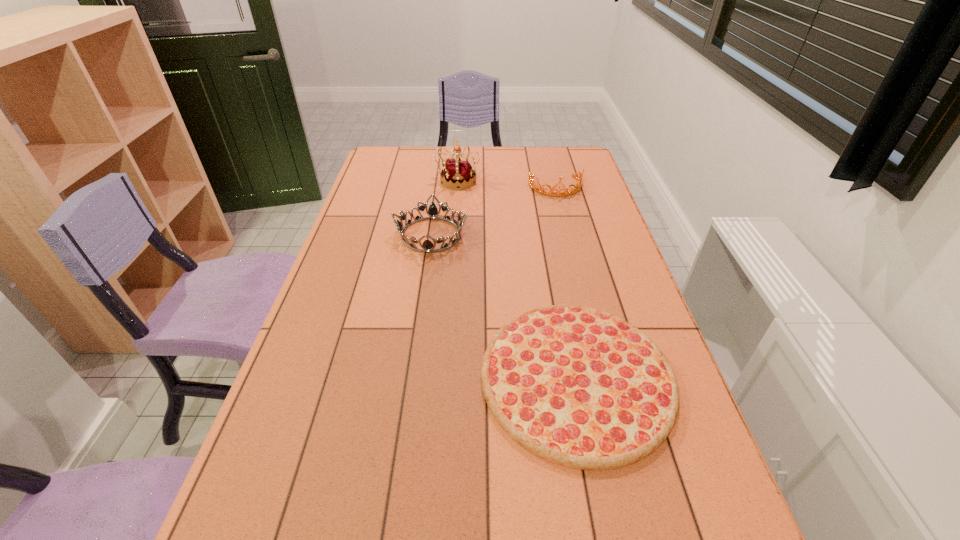
You are a GUI agent. You are given a task and a screenshot of the screen. Output one action in this format:
    pyautogui.click(x=<x>, y=<y>)
    Task: Click on the vacant space that satisfies the following two spatial constraints: 1. on the front-facing side of the nearest tiara; 2. on the left side of the pizza
    The width and height of the screenshot is (960, 540).
    Given the screenshot: What is the action you would take?
    pyautogui.click(x=411, y=377)

Where is `free location that satisfies the following two spatial constraints: 1. on the front-facing side of the pizza; 2. on the left side of the tallest object`? Image resolution: width=960 pixels, height=540 pixels. free location that satisfies the following two spatial constraints: 1. on the front-facing side of the pizza; 2. on the left side of the tallest object is located at coordinates (444, 377).

Identify the location of vacant area that satisfies the following two spatial constraints: 1. on the front-facing side of the pizza; 2. on the right side of the nearest tiara. The height and width of the screenshot is (540, 960). (411, 377).